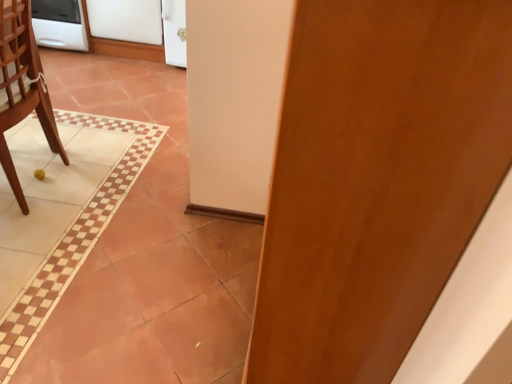
Find the location of a particular element. This screenshot has width=512, height=384. wooden door at center is located at coordinates (377, 179).

What is the approximate width of wooden door at center?

The width of wooden door at center is 13.37 inches.

Identify the location of white glossy oven at upper left. This screenshot has width=512, height=384. pyautogui.click(x=59, y=24).

Image resolution: width=512 pixels, height=384 pixels. Identify the location of white glossy screen door at upper center, acting as the 1th screen door starting from the right. (174, 32).

Image resolution: width=512 pixels, height=384 pixels. What do you see at coordinates (174, 32) in the screenshot?
I see `white glossy screen door at upper center, positioned as the second screen door in left-to-right order` at bounding box center [174, 32].

What do you see at coordinates (126, 20) in the screenshot?
I see `white matte refrigerator at upper left, which appears as the 1th screen door when viewed from the left` at bounding box center [126, 20].

I want to click on wooden chair at left, so click(x=22, y=87).

Is white glossy oven at upper left at the back of wooden door at center?

No, wooden door at center's orientation is not away from white glossy oven at upper left.

Can you tell me how much wooden door at center and white glossy oven at upper left differ in facing direction?

wooden door at center and white glossy oven at upper left are facing 90 degrees away from each other.

Is wooden door at center situated inside white glossy oven at upper left or outside?

wooden door at center is outside white glossy oven at upper left.

In terms of height, does wooden door at center look taller or shorter compared to white glossy oven at upper left?

In the image, wooden door at center appears to be taller than white glossy oven at upper left.

Is white glossy oven at upper left facing away from wooden door at center?

No, white glossy oven at upper left's orientation is not away from wooden door at center.

Between white glossy oven at upper left and wooden door at center, which one is positioned in front?

Positioned in front is wooden door at center.

Is white glossy oven at upper left thinner than wooden door at center?

No, white glossy oven at upper left is not thinner than wooden door at center.

Visually, is white glossy oven at upper left positioned to the left or to the right of wooden door at center?

Clearly, white glossy oven at upper left is on the left of wooden door at center in the image.

Considering the relative sizes of wooden chair at left and white matte refrigerator at upper left, which is the 2th screen door from right to left, in the image provided, is wooden chair at left wider than white matte refrigerator at upper left, which is the 2th screen door from right to left,?

Yes.

Consider the image. In terms of size, does wooden chair at left appear bigger or smaller than white matte refrigerator at upper left, which is the 2th screen door from right to left?

In the image, wooden chair at left appears to be larger than white matte refrigerator at upper left, which is the 2th screen door from right to left.

From the image's perspective, is wooden chair at left located above or below white matte refrigerator at upper left, which is the 2th screen door from right to left?

From the image's perspective, wooden chair at left appears below white matte refrigerator at upper left, which is the 2th screen door from right to left.

Can you confirm if wooden chair at left is positioned to the right of white matte refrigerator at upper left, which appears as the 1th screen door when viewed from the left?

In fact, wooden chair at left is to the left of white matte refrigerator at upper left, which appears as the 1th screen door when viewed from the left.

Is white matte refrigerator at upper left, which is the 2th screen door from right to left, a part of white glossy oven at upper left?

Actually, white matte refrigerator at upper left, which is the 2th screen door from right to left, is outside white glossy oven at upper left.

From the image's perspective, is white glossy oven at upper left below white matte refrigerator at upper left, which appears as the 1th screen door when viewed from the left?

No, from the image's perspective, white glossy oven at upper left is not beneath white matte refrigerator at upper left, which appears as the 1th screen door when viewed from the left.

Which is in front, point (71, 18) or point (140, 1)?

The point (140, 1) is in front.

From the picture: Can you confirm if white glossy oven at upper left is positioned to the right of white matte refrigerator at upper left, which appears as the 1th screen door when viewed from the left?

No, white glossy oven at upper left is not to the right of white matte refrigerator at upper left, which appears as the 1th screen door when viewed from the left.

From the image's perspective, is white glossy screen door at upper center, acting as the 1th screen door starting from the right, under white matte refrigerator at upper left, which is the 2th screen door from right to left?

Yes.

Are white glossy screen door at upper center, acting as the 1th screen door starting from the right, and white matte refrigerator at upper left, which appears as the 1th screen door when viewed from the left, beside each other?

There is a gap between white glossy screen door at upper center, acting as the 1th screen door starting from the right, and white matte refrigerator at upper left, which appears as the 1th screen door when viewed from the left.

At what (x,y) coordinates should I click in order to perform the action: click on screen door located above the white glossy screen door at upper center, acting as the 1th screen door starting from the right (from the image's perspective). Please return your answer as a coordinate pair (x, y). Looking at the image, I should click on (126, 20).

Is white glossy screen door at upper center, positioned as the second screen door in left-to-right order, aimed at white matte refrigerator at upper left, which appears as the 1th screen door when viewed from the left?

No, white glossy screen door at upper center, positioned as the second screen door in left-to-right order, does not turn towards white matte refrigerator at upper left, which appears as the 1th screen door when viewed from the left.

In terms of height, does wooden chair at left look taller or shorter compared to white glossy oven at upper left?

Considering their sizes, wooden chair at left has more height than white glossy oven at upper left.

Is wooden chair at left thinner than white glossy oven at upper left?

Indeed, wooden chair at left has a lesser width compared to white glossy oven at upper left.

Looking at this image, from the image's perspective, who appears lower, wooden chair at left or white glossy oven at upper left?

wooden chair at left, from the image's perspective.

Do you think wooden chair at left is within white glossy oven at upper left, or outside of it?

wooden chair at left is outside white glossy oven at upper left.

Is white glossy oven at upper left beside white glossy screen door at upper center, acting as the 1th screen door starting from the right?

white glossy oven at upper left and white glossy screen door at upper center, acting as the 1th screen door starting from the right, are not in contact.

From a real-world perspective, which is physically below, white glossy oven at upper left or white glossy screen door at upper center, acting as the 1th screen door starting from the right?

white glossy oven at upper left is physically lower.

Which is more to the right, white glossy oven at upper left or white glossy screen door at upper center, acting as the 1th screen door starting from the right?

Positioned to the right is white glossy screen door at upper center, acting as the 1th screen door starting from the right.

Locate an element on the screen. The height and width of the screenshot is (384, 512). appliance lying on the left of wooden door at center is located at coordinates (59, 24).

The width and height of the screenshot is (512, 384). What are the coordinates of `door lying in front of the white glossy oven at upper left` in the screenshot? It's located at (377, 179).

Looking at the image, which one is located further to wooden door at center, wooden chair at left or white glossy screen door at upper center, positioned as the second screen door in left-to-right order?

Based on the image, white glossy screen door at upper center, positioned as the second screen door in left-to-right order, appears to be further to wooden door at center.

From the image, which object appears to be farther from wooden door at center, white matte refrigerator at upper left, which is the 2th screen door from right to left, or white glossy oven at upper left?

white glossy oven at upper left.

From the picture: Which object lies further to the anchor point white glossy oven at upper left, white matte refrigerator at upper left, which is the 2th screen door from right to left, or wooden door at center?

wooden door at center is further to white glossy oven at upper left.

Looking at the image, which one is located further to white glossy oven at upper left, wooden door at center or white matte refrigerator at upper left, which appears as the 1th screen door when viewed from the left?

Among the two, wooden door at center is located further to white glossy oven at upper left.

When comparing their distances from white matte refrigerator at upper left, which appears as the 1th screen door when viewed from the left, does white glossy screen door at upper center, positioned as the second screen door in left-to-right order, or white glossy oven at upper left seem closer?

white glossy screen door at upper center, positioned as the second screen door in left-to-right order, is closer to white matte refrigerator at upper left, which appears as the 1th screen door when viewed from the left.

Considering their positions, is white glossy oven at upper left positioned further to wooden chair at left than white matte refrigerator at upper left, which appears as the 1th screen door when viewed from the left?

The object further to wooden chair at left is white glossy oven at upper left.

Estimate the real-world distances between objects in this image. Which object is closer to white glossy oven at upper left, wooden chair at left or wooden door at center?

wooden chair at left lies closer to white glossy oven at upper left than the other object.

When comparing their distances from white glossy screen door at upper center, positioned as the second screen door in left-to-right order, does wooden door at center or white glossy oven at upper left seem further?

wooden door at center.

This screenshot has width=512, height=384. What are the coordinates of `chair between wooden door at center and white glossy oven at upper left in the front-back direction` in the screenshot? It's located at click(22, 87).

The height and width of the screenshot is (384, 512). What are the coordinates of `chair positioned between wooden door at center and white glossy screen door at upper center, positioned as the second screen door in left-to-right order, from near to far` in the screenshot? It's located at pyautogui.click(x=22, y=87).

You are a GUI agent. You are given a task and a screenshot of the screen. Output one action in this format:
    pyautogui.click(x=<x>, y=<y>)
    Task: Click on the screen door positioned between wooden door at center and white matte refrigerator at upper left, which is the 2th screen door from right to left, from near to far
    
    Given the screenshot: What is the action you would take?
    pyautogui.click(x=174, y=32)

Locate an element on the screen. Image resolution: width=512 pixels, height=384 pixels. screen door between white glossy oven at upper left and white glossy screen door at upper center, positioned as the second screen door in left-to-right order, from left to right is located at coordinates (126, 20).